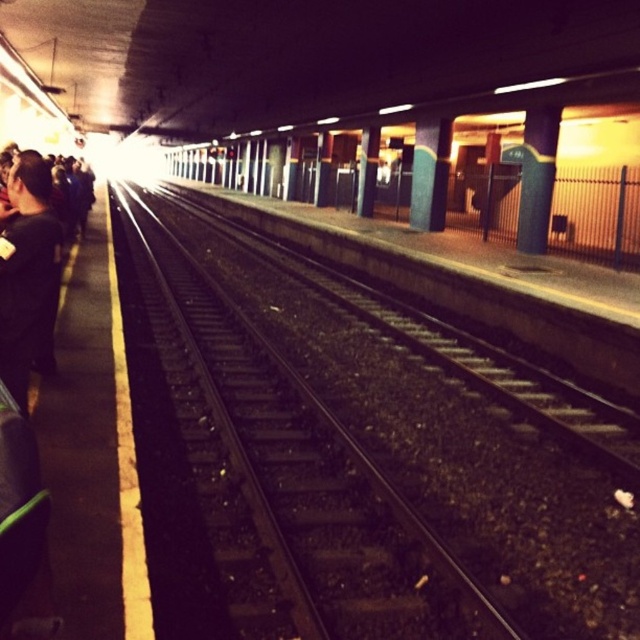
Question: Among these points, which one is nearest to the camera?

Choices:
 (A) (369, 554)
 (B) (541, 228)

Answer: (A)

Question: Does black metal track at center come behind smooth concrete pillar at right?

Choices:
 (A) yes
 (B) no

Answer: (B)

Question: Is black metal track at center positioned at the back of smooth concrete pillar at right?

Choices:
 (A) no
 (B) yes

Answer: (A)

Question: Which object appears farthest from the camera in this image?

Choices:
 (A) smooth concrete pillar at right
 (B) black metal track at center
 (C) black matte jacket at left

Answer: (A)

Question: Can you confirm if black matte jacket at left is positioned above smooth concrete pillar at right?

Choices:
 (A) yes
 (B) no

Answer: (B)

Question: Based on their relative distances, which object is farther from the black metal track at center?

Choices:
 (A) black matte jacket at left
 (B) smooth concrete pillar at right

Answer: (B)